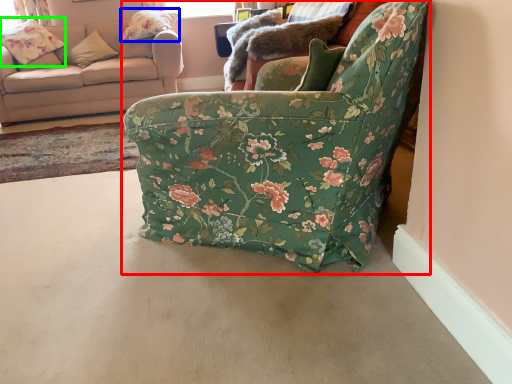
Question: Considering the real-world distances, which object is closest to chair (highlighted by a red box)? pillow (highlighted by a blue box) or flower (highlighted by a green box).

Choices:
 (A) pillow
 (B) flower

Answer: (A)